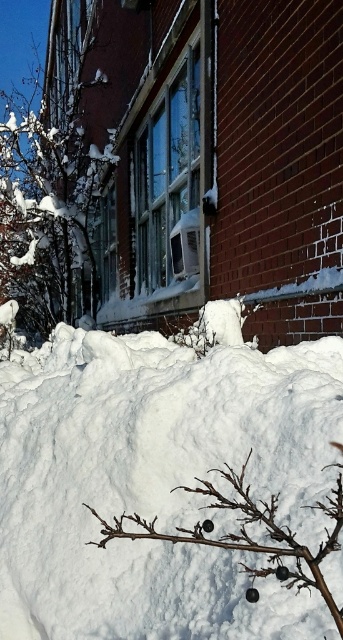
Is snow-covered tree at left taller than dark brown twig at lower center?

Yes, snow-covered tree at left is taller than dark brown twig at lower center.

Who is more forward, [56,173] or [242,531]?

Point [242,531] is more forward.

Between point (48, 173) and point (297, 552), which one is positioned in front?

Point (297, 552) is in front.

I want to click on snow-covered tree at left, so click(x=45, y=209).

Can you confirm if white fluffy snow at lower center is positioned above snow-covered tree at left?

Actually, white fluffy snow at lower center is below snow-covered tree at left.

Can you confirm if white fluffy snow at lower center is positioned below snow-covered tree at left?

Yes, white fluffy snow at lower center is below snow-covered tree at left.

Between point (133, 493) and point (29, 150), which one is positioned in front?

Positioned in front is point (133, 493).

Where is `white fluffy snow at lower center`? This screenshot has height=640, width=343. white fluffy snow at lower center is located at coordinates (157, 483).

Who is positioned more to the right, white fluffy snow at lower center or dark brown twig at lower center?

Positioned to the right is dark brown twig at lower center.

Consider the image. Can you confirm if white fluffy snow at lower center is taller than dark brown twig at lower center?

Correct, white fluffy snow at lower center is much taller as dark brown twig at lower center.

Which is in front, point (136, 570) or point (136, 515)?

Point (136, 515)

This screenshot has width=343, height=640. I want to click on white fluffy snow at lower center, so click(157, 483).